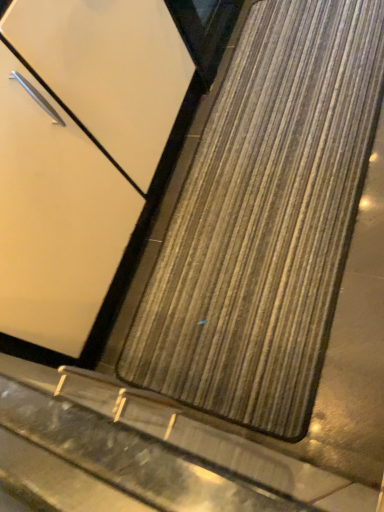
Question: Is matte white door at center at the back of wooden mat at center?

Choices:
 (A) yes
 (B) no

Answer: (B)

Question: From a real-world perspective, is wooden mat at center on matte white door at center?

Choices:
 (A) yes
 (B) no

Answer: (B)

Question: Is wooden mat at center taller than matte white door at center?

Choices:
 (A) no
 (B) yes

Answer: (A)

Question: Is wooden mat at center far away from matte white door at center?

Choices:
 (A) yes
 (B) no

Answer: (B)

Question: Is wooden mat at center at the left side of matte white door at center?

Choices:
 (A) yes
 (B) no

Answer: (B)

Question: Is wooden mat at center smaller than matte white door at center?

Choices:
 (A) yes
 (B) no

Answer: (A)

Question: Can you confirm if matte white door at center is taller than wooden mat at center?

Choices:
 (A) yes
 (B) no

Answer: (A)

Question: Does matte white door at center lie in front of wooden mat at center?

Choices:
 (A) yes
 (B) no

Answer: (A)

Question: From the image's perspective, is matte white door at center located beneath wooden mat at center?

Choices:
 (A) yes
 (B) no

Answer: (B)

Question: Are matte white door at center and wooden mat at center far apart?

Choices:
 (A) yes
 (B) no

Answer: (B)

Question: Is the depth of matte white door at center greater than that of wooden mat at center?

Choices:
 (A) yes
 (B) no

Answer: (B)

Question: Is matte white door at center to the right of wooden mat at center from the viewer's perspective?

Choices:
 (A) yes
 (B) no

Answer: (B)

Question: Choose the correct answer: Is matte white door at center inside wooden mat at center or outside it?

Choices:
 (A) outside
 (B) inside

Answer: (A)